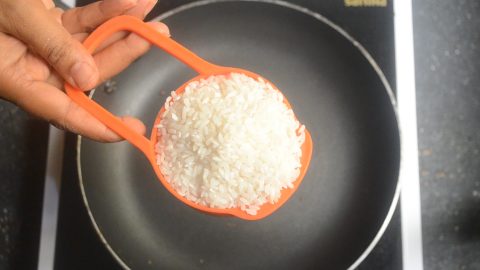
At what (x,y) coordinates should I click in order to perform the action: click on orange cup white rice is in. Please return your answer as a coordinate pair (x, y). Image resolution: width=480 pixels, height=270 pixels. Looking at the image, I should click on (307, 151).